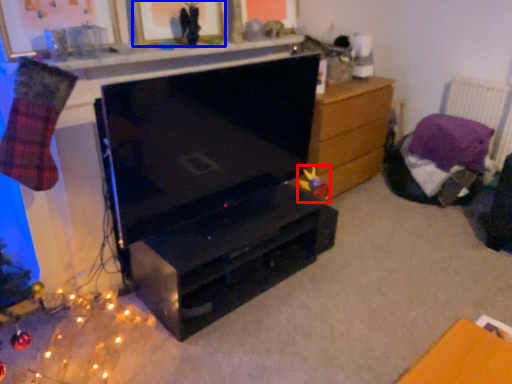
Question: Which object is further to the camera taking this photo, toy (highlighted by a red box) or picture frame (highlighted by a blue box)?

Choices:
 (A) toy
 (B) picture frame

Answer: (A)